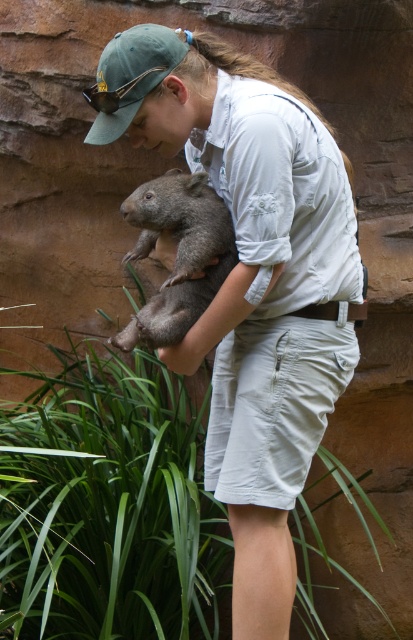
You are a photographer trying to capture a closeup shot of the fuzzy gray wombat at center while ensuring the light gray cotton shirt at center is also visible in the frame. Given their sizes, which subject should you focus on to include both in the composition without cropping either?

Since the light gray cotton shirt at center is wider than the fuzzy gray wombat at center, you should focus on the fuzzy gray wombat at center as it is smaller and ensure it stays within the frame while the shirt, being wider, will naturally occupy more space but still remain visible.

You are a photographer trying to capture a closeup of the fuzzy gray wombat at center while ensuring the light gray cotton shirt at center is visible in the frame. Which side of the wombat should you position yourself to include both the wombat and the shirt in the photo?

The light gray cotton shirt at center is positioned on the right side of the fuzzy gray wombat at center, so positioning yourself to the left of the wombat would allow both the wombat and the shirt to be visible in the frame.

You are a zookeeper observing the scene. The light gray cotton shirt at center and the fuzzy gray wombat at center are both visible. Which object is positioned higher in the image?

The fuzzy gray wombat at center is higher than the light gray cotton shirt at center.